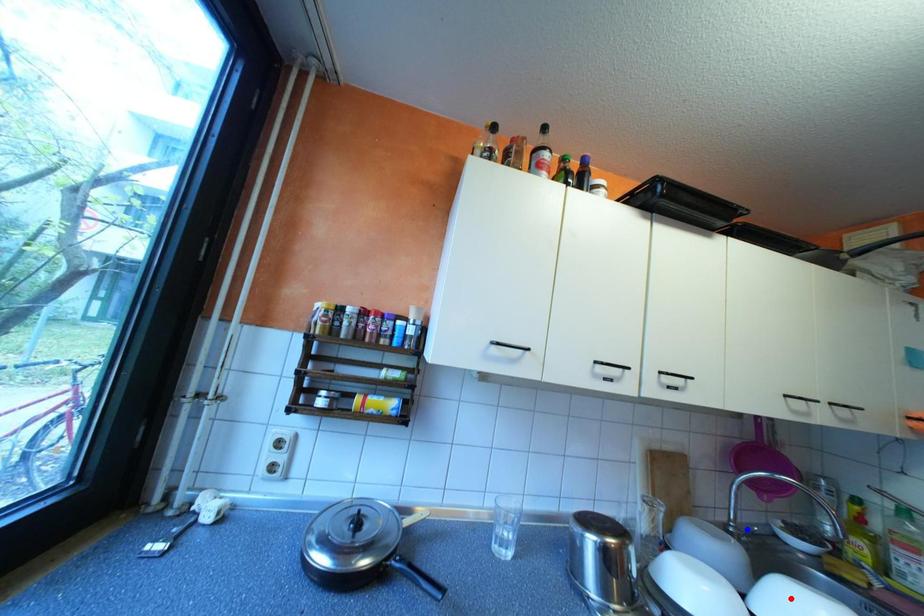
Question: In the image, two points are highlighted. Which point is nearer to the camera? Reply with the corresponding letter.

Choices:
 (A) blue point
 (B) red point

Answer: (B)